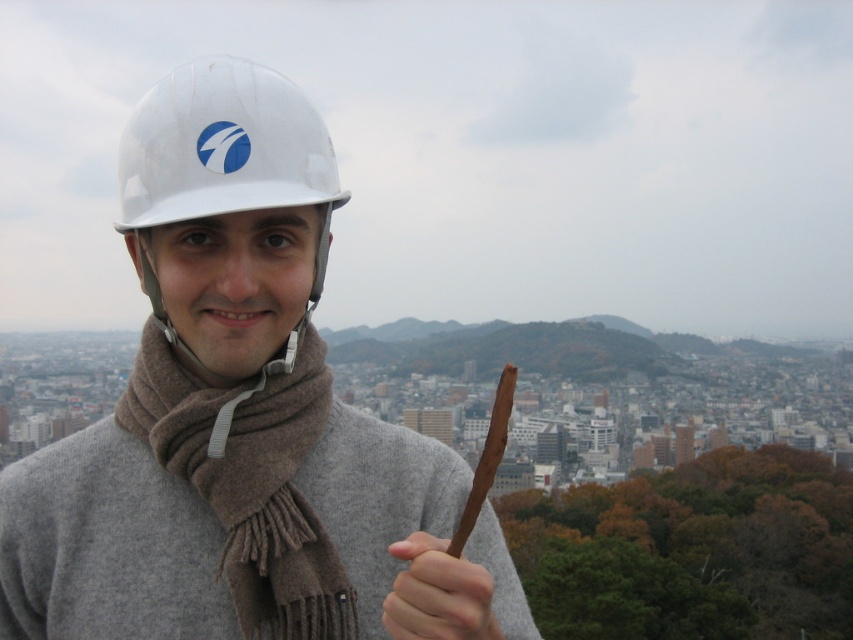
You are standing at the point marked as point (152, 616) in the image. You want to walk to the city center located 200 meters away from your current position. Can you reach the city center without moving beyond the visible cityscape in the image?

The distance between point (152, 616) and the viewer is 131.26 meters. Since the city center is 200 meters away from your current position, you would need to walk an additional 68.74 meters beyond the current visible cityscape to reach it.

You are a photographer trying to capture the person in the scene. If you want to focus on the smooth brown stick at center without the brown woolen scarf at center blocking it, where should you position your camera?

The brown woolen scarf at center is above the smooth brown stick at center, so positioning the camera slightly below the stick would allow you to capture it without the scarf blocking the view.